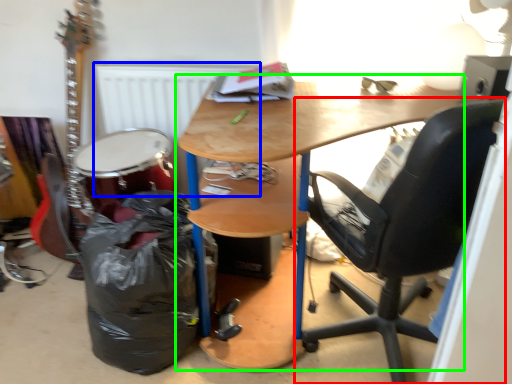
Question: Which object is positioned farthest from chair (highlighted by a red box)? Select from radiator (highlighted by a blue box) and desk (highlighted by a green box).

Choices:
 (A) radiator
 (B) desk

Answer: (A)